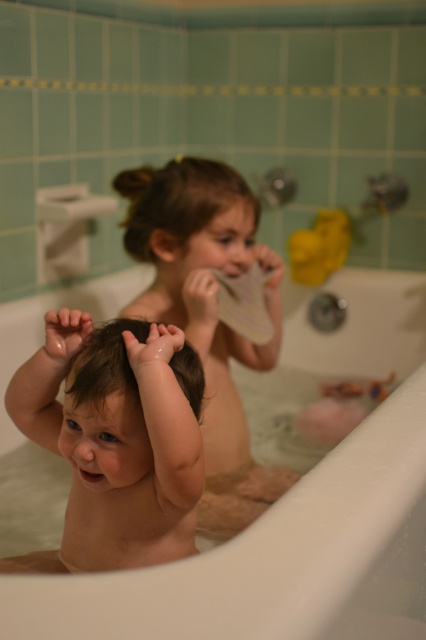
You are a bathroom designer planning to install a new faucet. The current smooth white bathtub at center is positioned at coordinates 0.787 on the x and 0.653 on the y. If the faucet needs to be placed 0.1 units to the left and 0.05 units higher than the bathtub, what are the new coordinates for the faucet?

The smooth white bathtub at center is located at point (278, 502). To place the faucet 0.1 units to the left, subtract 0.1 from the x coordinate, resulting in 0.687. To position it 0.05 units higher, subtract 0.05 from the y coordinate, resulting in 0.603. Therefore, the faucet should be placed at coordinates 0.687 on the x and 0.603 on the y.

You are a delivery robot trying to place a large box in the bathroom. The box requires a flat surface that is at least 1 meter wide. Can you place the box on the smooth white bathtub at center?

The smooth white bathtub at center is located at point coordinates of [278,502]. Since the coordinates do not provide information about the bathtub width, it is impossible to determine if the bathtub is wide enough to accommodate the box. Please check the bathtub width before placing the box.

In the bathroom scene, there is a smooth white bathtub at center and a smooth skin baby at center. Which object is located to the right of the other?

The smooth white bathtub at center is positioned on the right side of smooth skin baby at center.